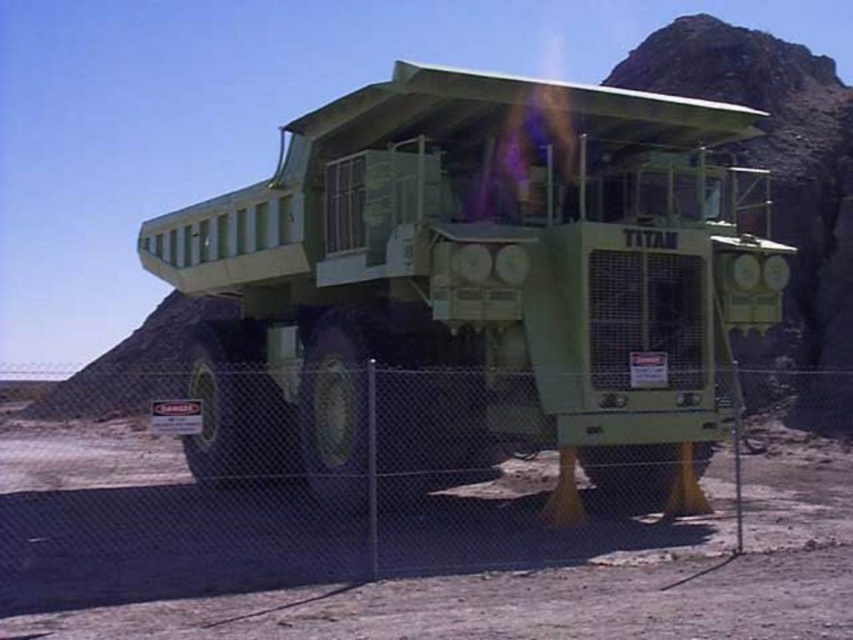
Question: Which point is farther to the camera?

Choices:
 (A) metal chain-link fence at lower center
 (B) green matte titan truck at center

Answer: (B)

Question: Which object appears closest to the camera in this image?

Choices:
 (A) metal chain-link fence at lower center
 (B) green matte titan truck at center

Answer: (A)

Question: Is green matte titan truck at center to the right of metal chain-link fence at lower center from the viewer's perspective?

Choices:
 (A) yes
 (B) no

Answer: (A)

Question: Is green matte titan truck at center behind metal chain-link fence at lower center?

Choices:
 (A) no
 (B) yes

Answer: (B)

Question: Among these points, which one is farthest from the camera?

Choices:
 (A) (62, 492)
 (B) (605, 148)

Answer: (A)

Question: Can you confirm if green matte titan truck at center is bigger than metal chain-link fence at lower center?

Choices:
 (A) no
 (B) yes

Answer: (B)